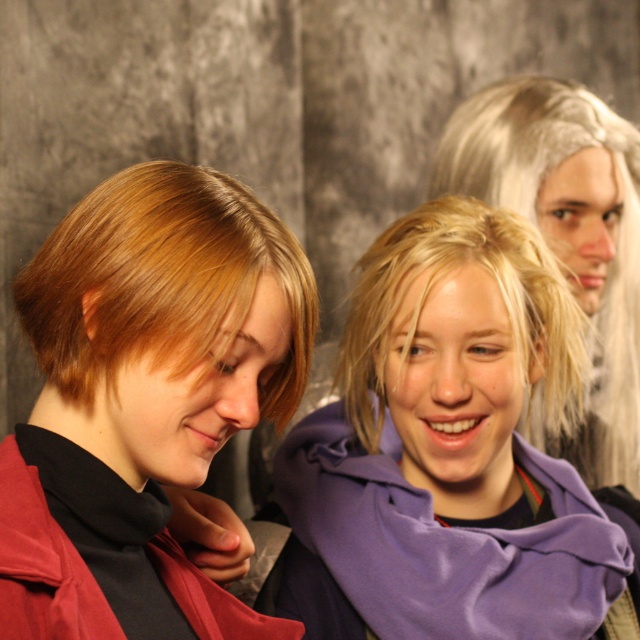
Question: Which point is closer to the camera?

Choices:
 (A) matte red jacket at lower left
 (B) blonde hair at center
 (C) blonde wig at upper right
 (D) purple fleece scarf at center

Answer: (A)

Question: From the image, what is the correct spatial relationship of purple fleece scarf at center in relation to matte red jacket at lower left?

Choices:
 (A) left
 (B) right

Answer: (B)

Question: Is blonde wig at upper right to the left of matte red jacket at lower left from the viewer's perspective?

Choices:
 (A) no
 (B) yes

Answer: (A)

Question: Which of the following is the farthest from the observer?

Choices:
 (A) purple fleece scarf at center
 (B) blonde hair at center

Answer: (B)

Question: Does matte red coat at left have a greater width compared to matte red jacket at lower left?

Choices:
 (A) no
 (B) yes

Answer: (B)

Question: Estimate the real-world distances between objects in this image. Which object is farther from the matte red coat at left?

Choices:
 (A) purple fleece scarf at center
 (B) matte red jacket at lower left
 (C) blonde wig at upper right

Answer: (C)